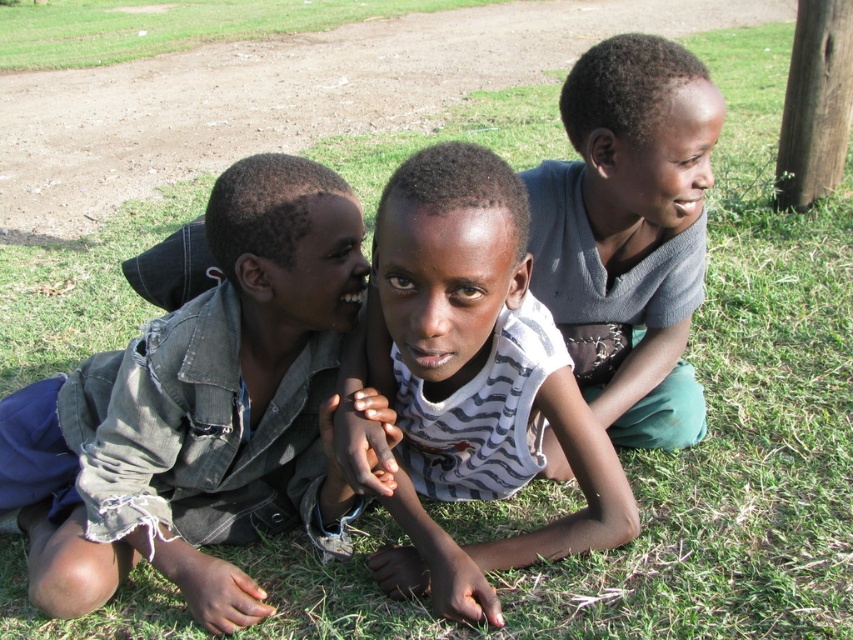
Question: Can you confirm if striped fabric shirt at center is positioned above gray matte shirt at upper right?

Choices:
 (A) no
 (B) yes

Answer: (A)

Question: Based on their relative distances, which object is farther from the striped fabric shirt at center?

Choices:
 (A) gray matte shirt at upper right
 (B) ripped denim jacket at center

Answer: (A)

Question: Is ripped denim jacket at center above gray matte shirt at upper right?

Choices:
 (A) no
 (B) yes

Answer: (A)

Question: Can you confirm if striped fabric shirt at center is positioned below gray matte shirt at upper right?

Choices:
 (A) no
 (B) yes

Answer: (B)

Question: Which point is closer to the camera?

Choices:
 (A) (250, 332)
 (B) (689, 124)
 (C) (395, 312)

Answer: (C)

Question: Which of these objects is positioned closest to the gray matte shirt at upper right?

Choices:
 (A) striped fabric shirt at center
 (B) ripped denim jacket at center

Answer: (A)